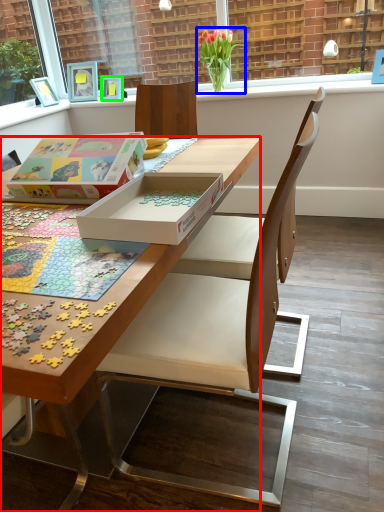
Question: Which object is positioned closest to desk (highlighted by a red box)? Select from flower (highlighted by a blue box) and picture frame (highlighted by a green box).

Choices:
 (A) flower
 (B) picture frame

Answer: (A)